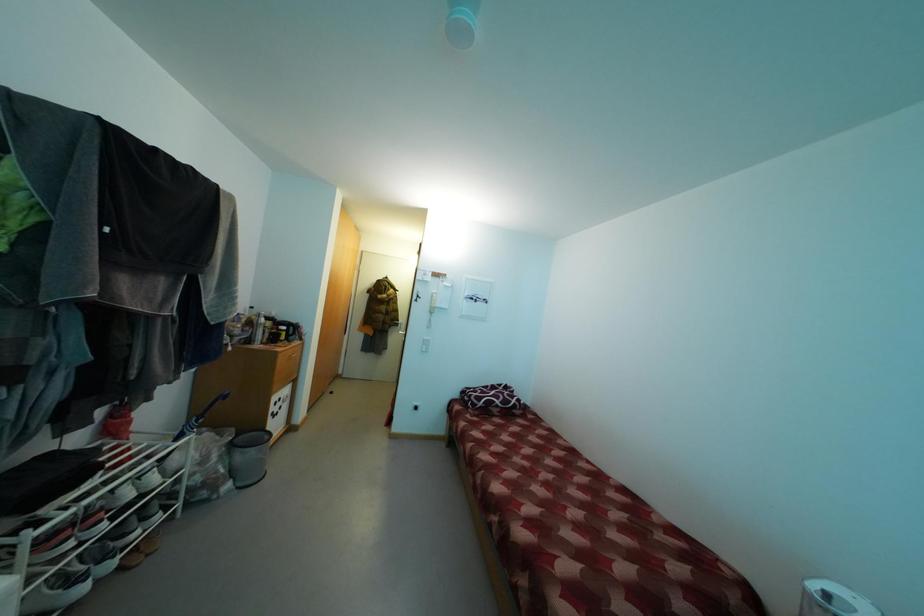
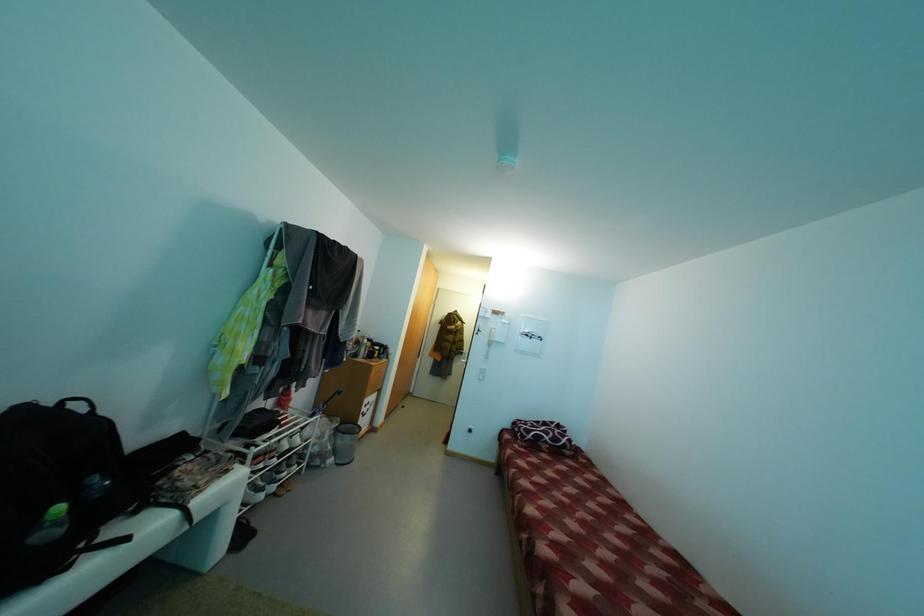
Which direction would the cameraman need to move to produce the second image?

The movement direction of the cameraman is right, backward.